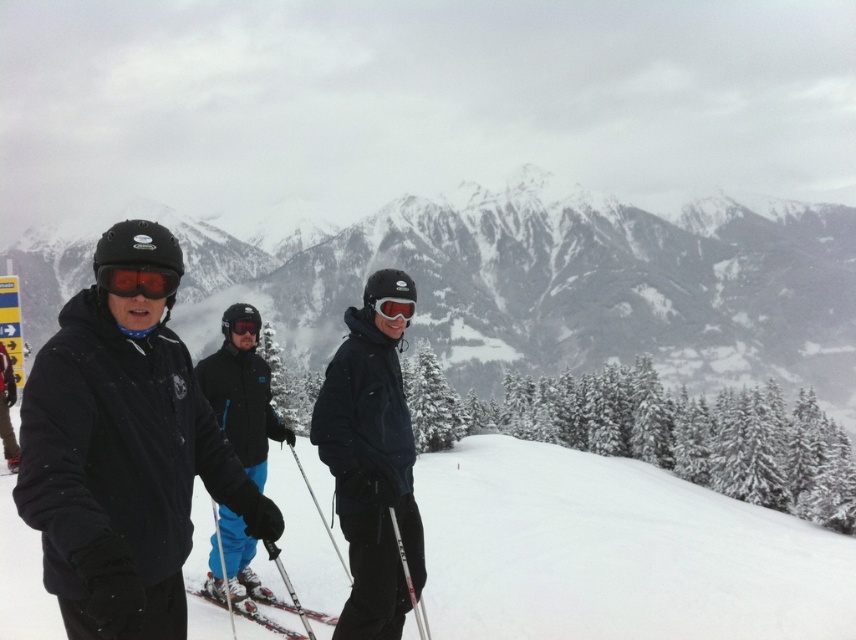
Is snowy mountain at center positioned before matte black ski jacket at center?

No.

Where is `snowy mountain at center`? The image size is (856, 640). snowy mountain at center is located at coordinates click(563, 285).

Measure the distance between point (807, 337) and camera.

The distance of point (807, 337) from camera is 903.26 feet.

Locate an element on the screen. snowy mountain at center is located at coordinates (563, 285).

Can you confirm if white matte skis at center is smaller than red reflective lens goggles at center?

Indeed, white matte skis at center has a smaller size compared to red reflective lens goggles at center.

Can you confirm if white matte skis at center is bigger than red reflective lens goggles at center?

Incorrect, white matte skis at center is not larger than red reflective lens goggles at center.

You are a GUI agent. You are given a task and a screenshot of the screen. Output one action in this format:
    pyautogui.click(x=<x>, y=<y>)
    Task: Click on the white matte skis at center
    This screenshot has height=640, width=856.
    Given the screenshot: What is the action you would take?
    pyautogui.click(x=265, y=616)

You are a GUI agent. You are given a task and a screenshot of the screen. Output one action in this format:
    pyautogui.click(x=<x>, y=<y>)
    Task: Click on the white matte skis at center
    The height and width of the screenshot is (640, 856).
    Given the screenshot: What is the action you would take?
    pyautogui.click(x=265, y=616)

Is matte black goggles at center below glossy plastic goggles at center?

No, matte black goggles at center is not below glossy plastic goggles at center.

Who is more forward, (116,284) or (409,316)?

Point (116,284) is more forward.

The width and height of the screenshot is (856, 640). Identify the location of matte black goggles at center. (137, 280).